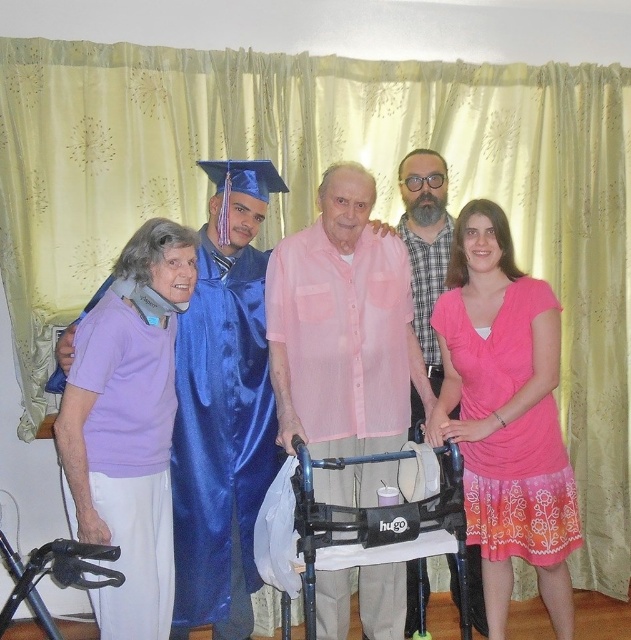
Question: Which point is farther to the camera?

Choices:
 (A) (498, 627)
 (B) (227, 556)
 (C) (416, 266)

Answer: (C)

Question: Which of the following is the closest to the observer?

Choices:
 (A) (416, 266)
 (B) (333, 582)
 (C) (456, 561)
 (D) (565, 502)

Answer: (B)

Question: Among these objects, which one is farthest from the camera?

Choices:
 (A) purple fabric neck brace at left
 (B) blue satin graduation gown at center
 (C) pink satin walker at center
 (D) satin blue graduation gown at center

Answer: (B)

Question: Can you confirm if purple fabric neck brace at left is positioned below satin blue graduation gown at center?

Choices:
 (A) no
 (B) yes

Answer: (A)

Question: Is purple fabric neck brace at left thinner than blue satin graduation gown at center?

Choices:
 (A) no
 (B) yes

Answer: (A)

Question: Is pink sheer shirt at center below pink fabric dress at center?

Choices:
 (A) yes
 (B) no

Answer: (B)